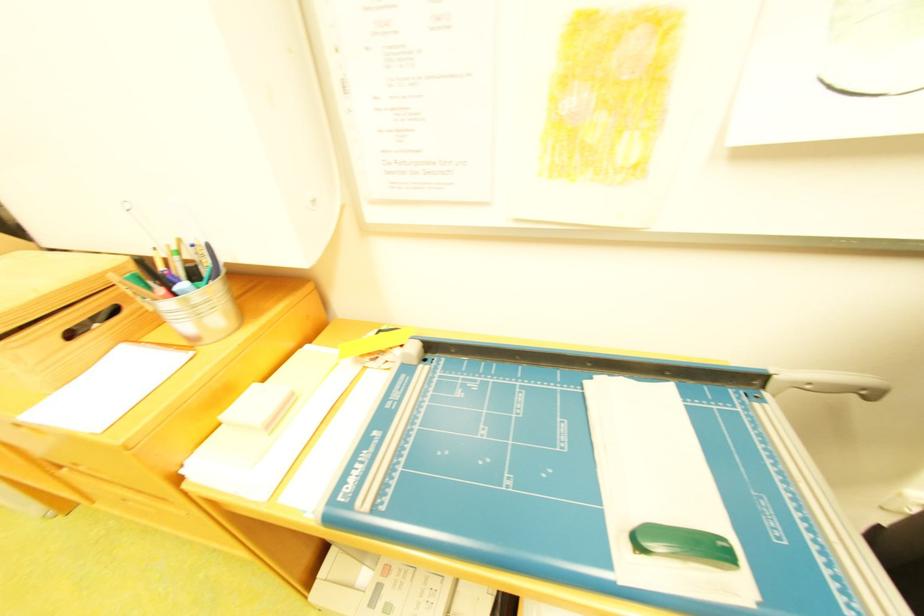
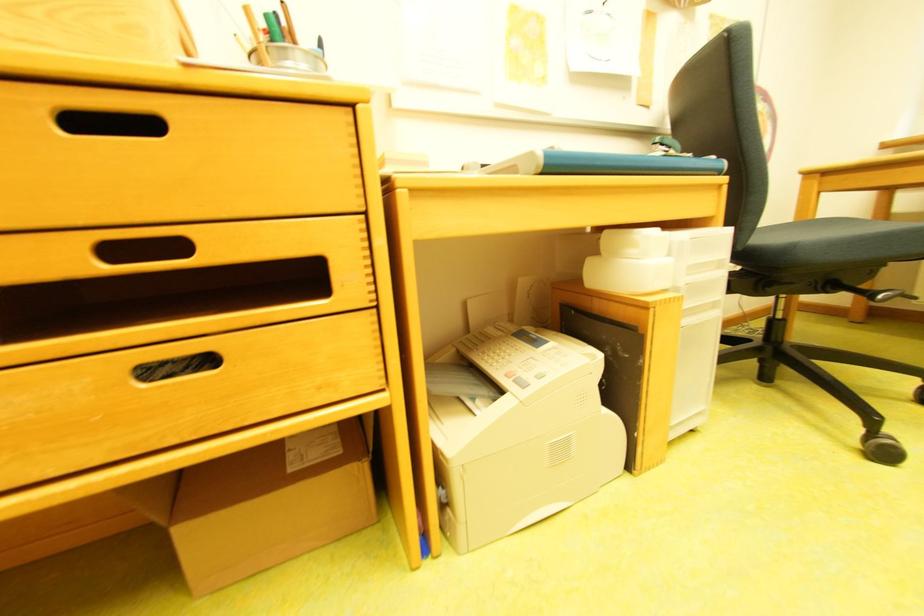
Question: I am providing you with two images of the same scene from different viewpoints. Please identify which objects are invisible in image2.

Choices:
 (A) cardboard box
 (B) chair sitting surface
 (C) black sink plug
 (D) small white notepad

Answer: (D)